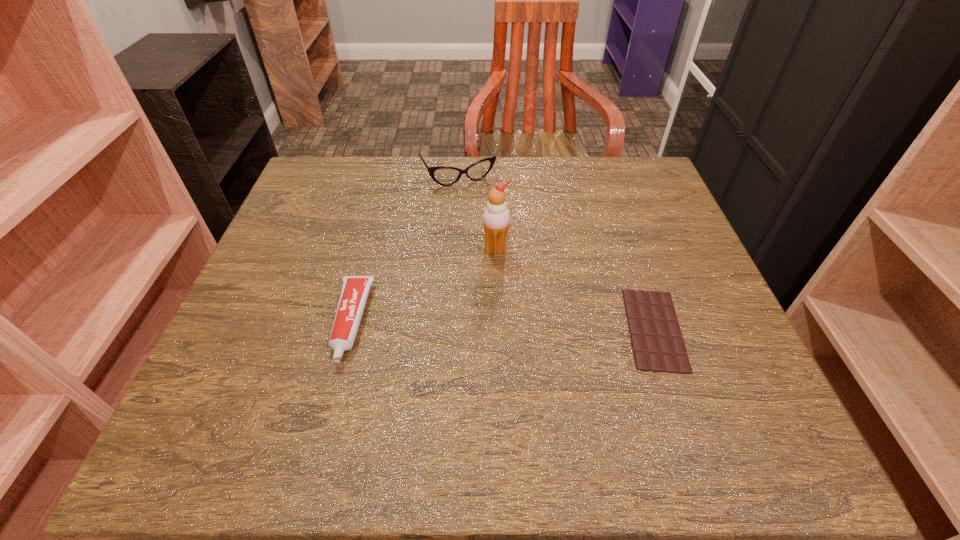
The image size is (960, 540). Identify the location of vacant space at the far edge of the desktop. (521, 178).

Where is `vacant space at the left edge`? vacant space at the left edge is located at coordinates (340, 258).

This screenshot has width=960, height=540. In the image, there is a desktop. What are the coordinates of `blank space at the right edge` in the screenshot? It's located at (648, 221).

Identify the location of free space at the far right corner of the desktop. This screenshot has height=540, width=960. (596, 156).

Where is `vacant space at the near right corner`? vacant space at the near right corner is located at coordinates (711, 397).

The height and width of the screenshot is (540, 960). In order to click on empty space between the icecream and the farthest object in this screenshot , I will do `click(476, 212)`.

Find the location of a particular element. The width and height of the screenshot is (960, 540). free space between the chocolate bar and the tallest object is located at coordinates (575, 289).

Locate an element on the screen. The height and width of the screenshot is (540, 960). unoccupied area between the chocolate bar and the farthest object is located at coordinates (556, 252).

Where is `free area in between the leftmost object and the tallest object`? free area in between the leftmost object and the tallest object is located at coordinates (423, 286).

Locate an element on the screen. vacant space in between the shortest object and the toothpaste is located at coordinates point(502,325).